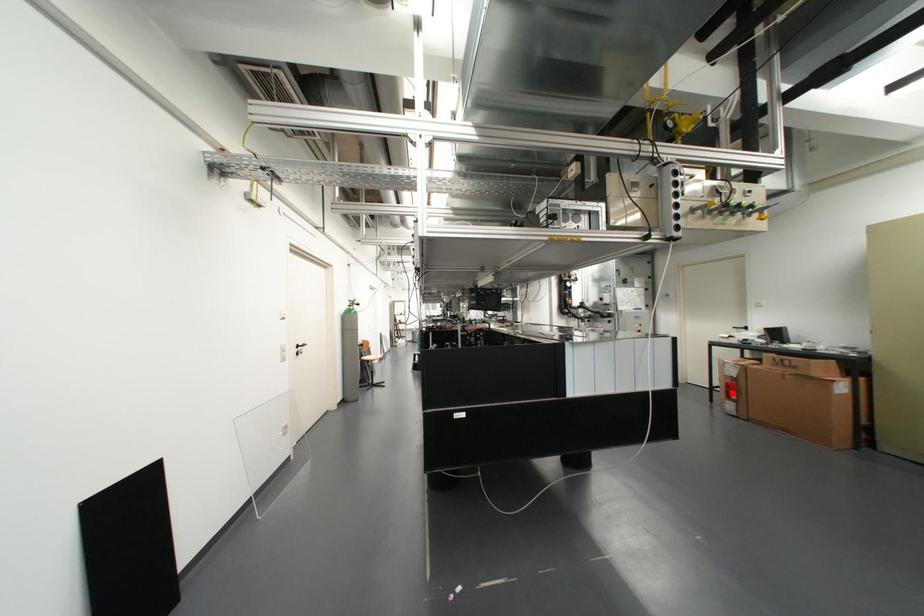
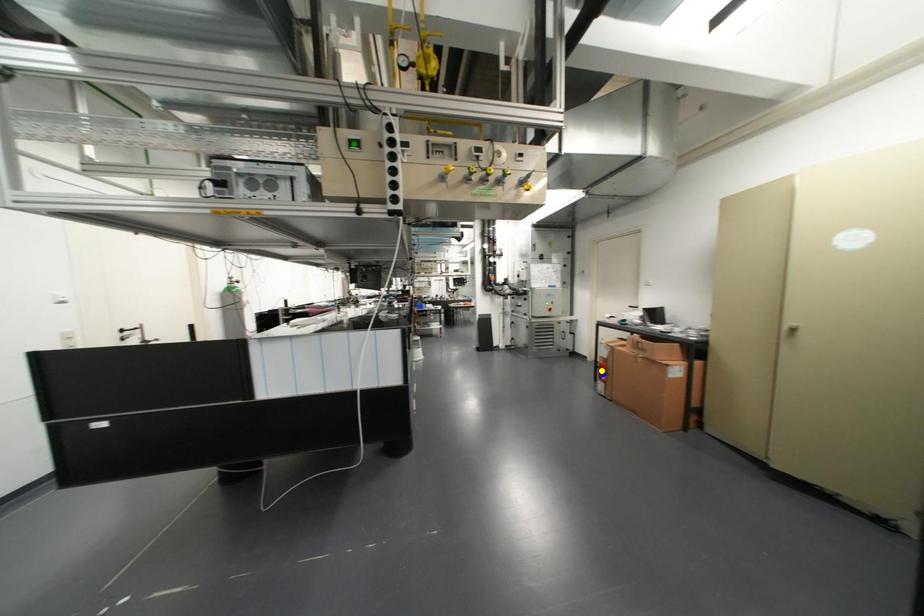
Question: I am providing you with two images of the same scene from different viewpoints. A red point is marked on the first image. You are given multiple points on the second image. Which mark in image 2 goes with the point in image 1?

Choices:
 (A) blue point
 (B) green point
 (C) yellow point

Answer: (A)